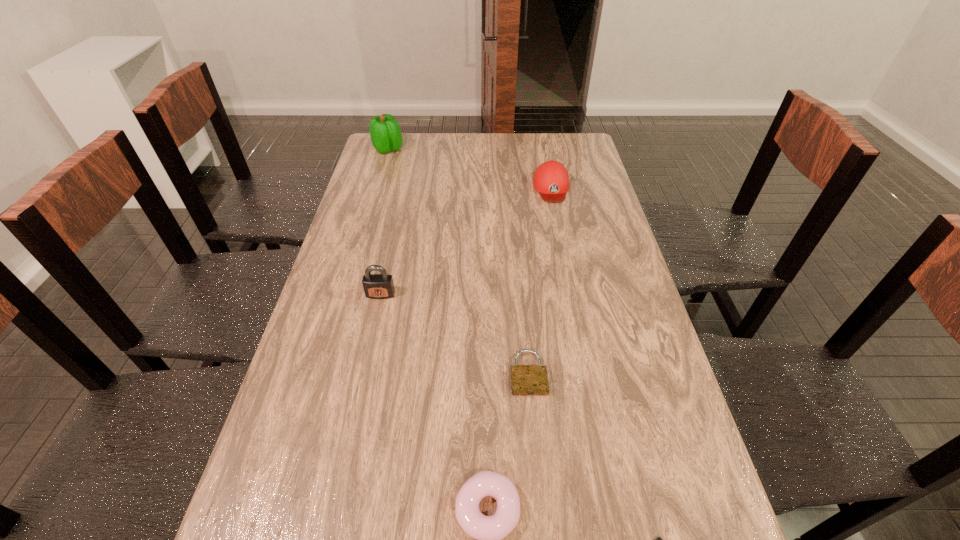
Find the location of a particular element. The height and width of the screenshot is (540, 960). the tallest object is located at coordinates (385, 132).

Locate an element on the screen. This screenshot has width=960, height=540. the farthest object is located at coordinates (385, 132).

Image resolution: width=960 pixels, height=540 pixels. What are the coordinates of `the left padlock` in the screenshot? It's located at (376, 286).

Where is `the taller padlock`? This screenshot has height=540, width=960. the taller padlock is located at coordinates (376, 286).

Where is `baseball cap`? The height and width of the screenshot is (540, 960). baseball cap is located at coordinates (551, 180).

Identify the location of the fifth nearest object. (551, 180).

Locate an element on the screen. the fifth tallest object is located at coordinates 528,380.

Where is `the shorter padlock`? the shorter padlock is located at coordinates (528, 380).

The width and height of the screenshot is (960, 540). In order to click on vacant space located on the front of the tallest object in this screenshot , I will do `click(381, 173)`.

At what (x,y) coordinates should I click in order to perform the action: click on free region located on the front of the fourth nearest object near the keyhole. Please return your answer as a coordinate pair (x, y). Looking at the image, I should click on (353, 419).